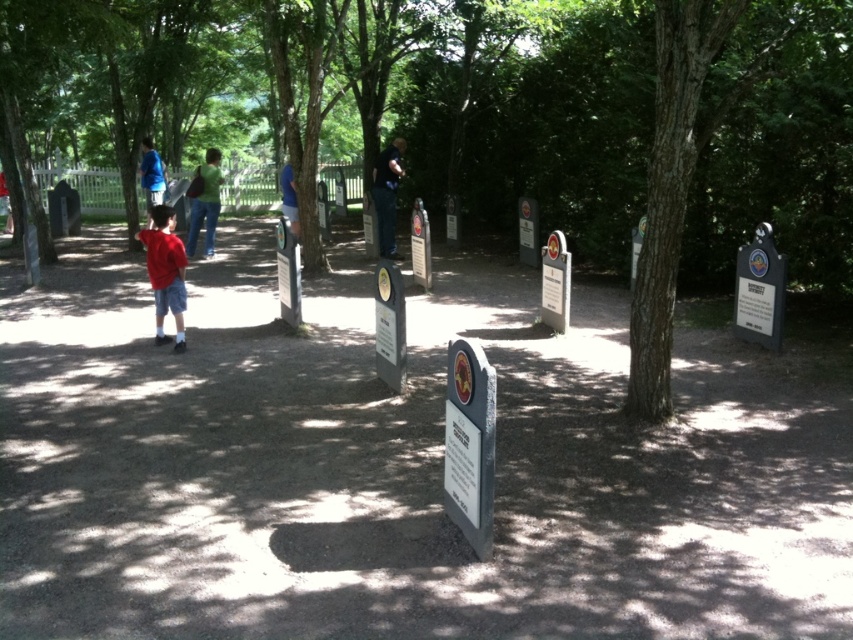
Question: Which of the following is the closest to the observer?

Choices:
 (A) (207, 252)
 (B) (151, 221)

Answer: (B)

Question: Which point appears farthest from the camera in this image?

Choices:
 (A) [192, 244]
 (B) [456, 13]

Answer: (B)

Question: Is blue jeans at center positioned behind blue fabric shirt at center?

Choices:
 (A) yes
 (B) no

Answer: (A)

Question: Is green textured tree at center positioned before blue jeans at center?

Choices:
 (A) no
 (B) yes

Answer: (B)

Question: Which point is closer to the camera taking this photo?

Choices:
 (A) (213, 228)
 (B) (158, 195)
 (C) (387, 234)

Answer: (C)

Question: Observing the image, what is the correct spatial positioning of red matte shirt at left in reference to blue jeans at center?

Choices:
 (A) below
 (B) above

Answer: (A)